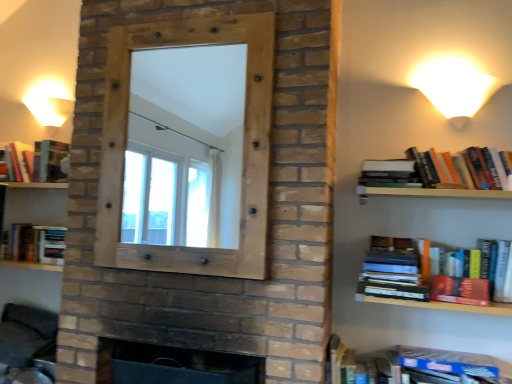
The width and height of the screenshot is (512, 384). In order to click on empty space that is ontop of wooden frame at center (from a real-world perspective) in this screenshot , I will do `click(185, 21)`.